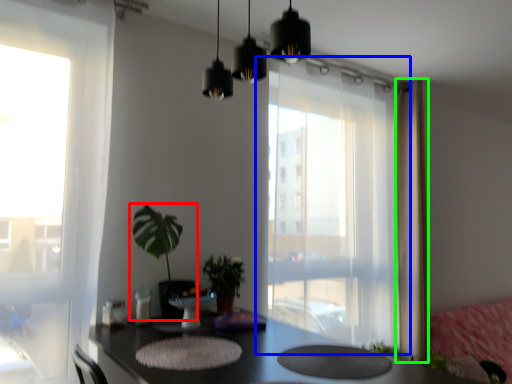
Question: Based on their relative distances, which object is farther from houseplant (highlighted by a red box)? Choose from window (highlighted by a blue box) and curtain (highlighted by a green box).

Choices:
 (A) window
 (B) curtain

Answer: (B)